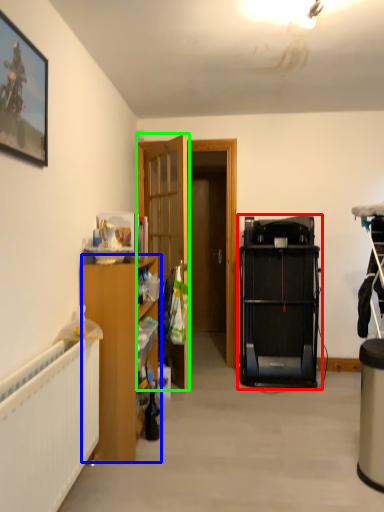
Question: Considering the real-world distances, which object is closest to equipment (highlighted by a red box)? cabinetry (highlighted by a blue box) or door (highlighted by a green box).

Choices:
 (A) cabinetry
 (B) door

Answer: (B)